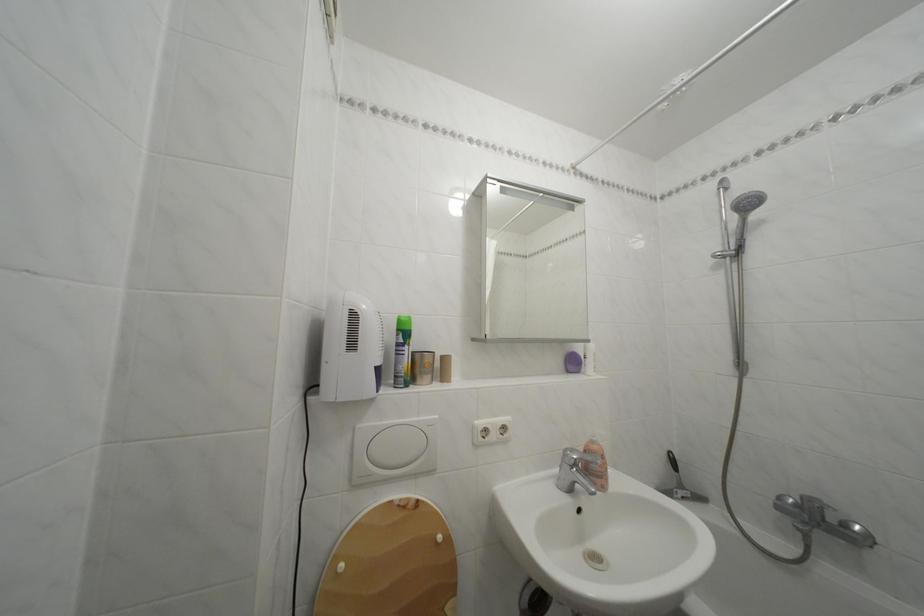
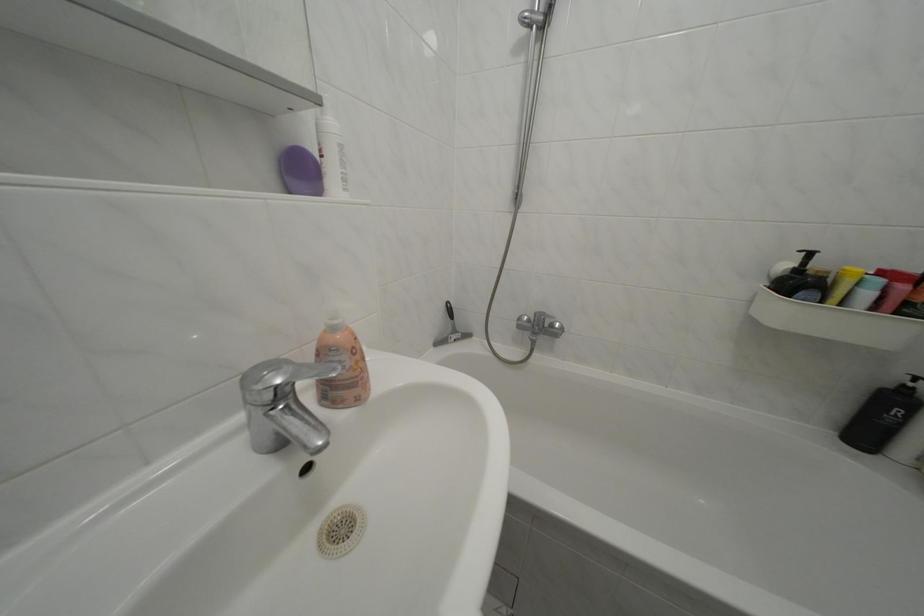
Where in the second image is the point corresponding to [602,448] from the first image?

(342, 334)